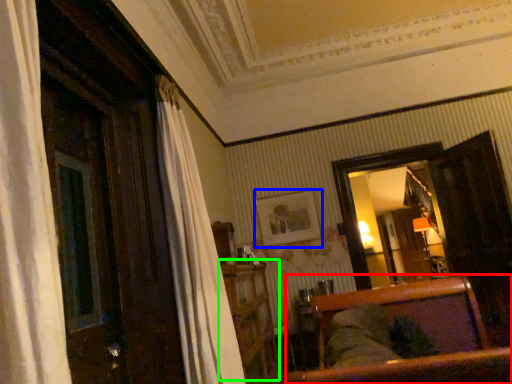
Question: Which object is positioned closest to furniture (highlighted by a red box)? Select from picture frame (highlighted by a blue box) and dresser (highlighted by a green box).

Choices:
 (A) picture frame
 (B) dresser

Answer: (B)